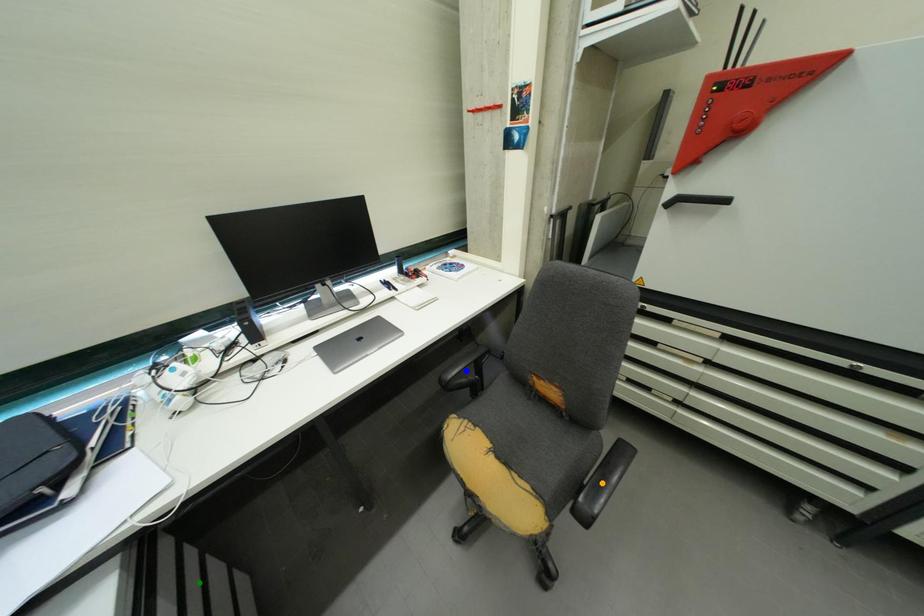
Order these from nearest to farthest:
orange point | green point | blue point

green point, orange point, blue point